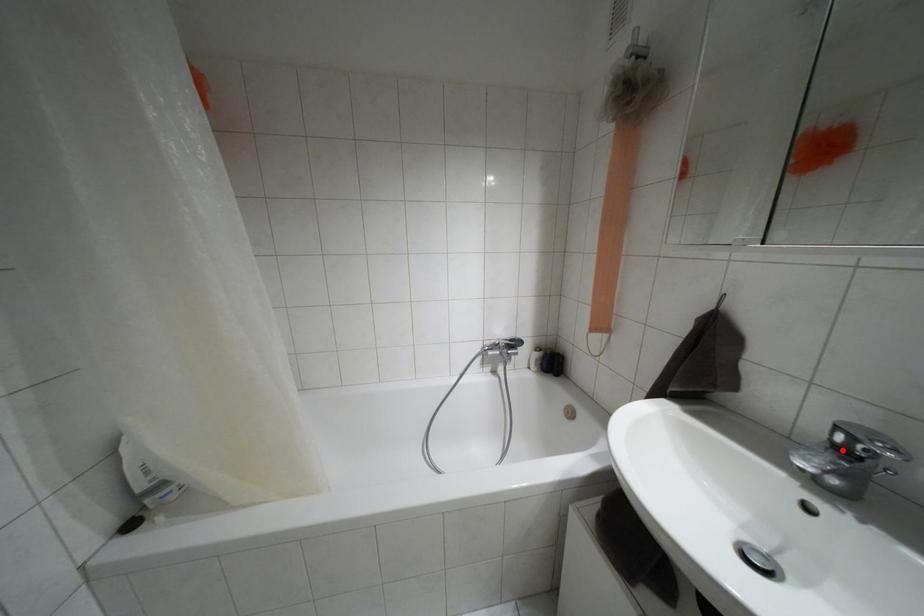
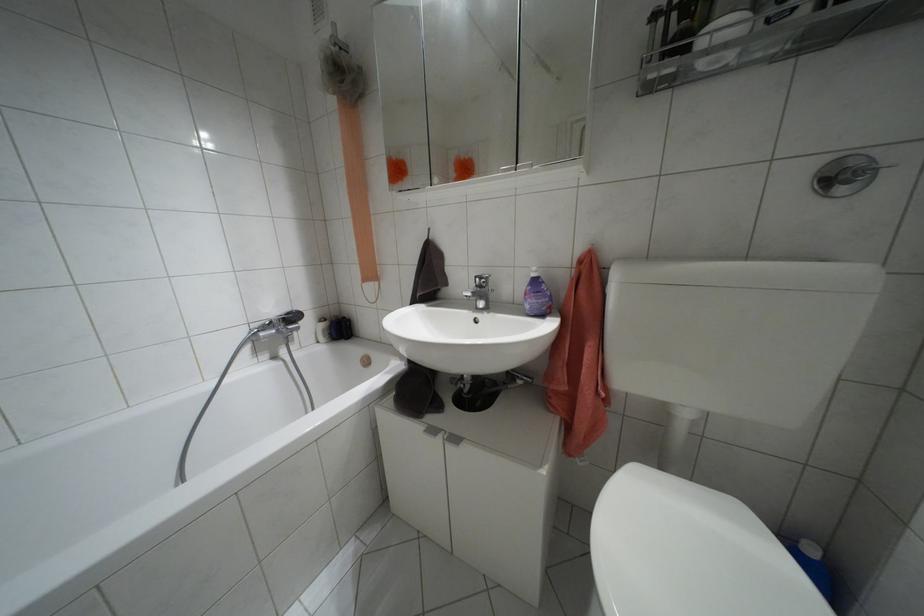
Locate, in the second image, the point that corresponds to the highlighted location in the first image.

(479, 286)